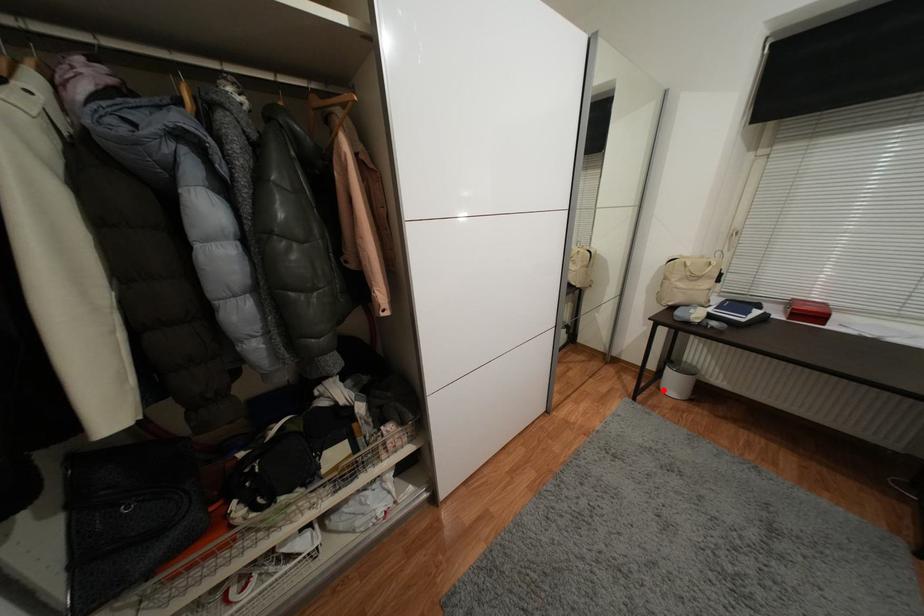
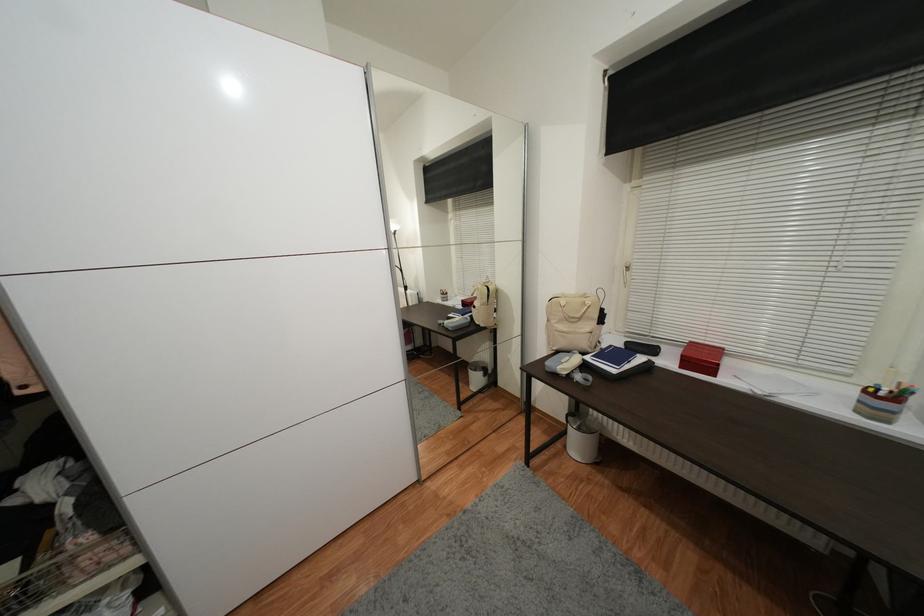
Find the pixel in the second image that matches the highlighted location in the first image.

(569, 448)